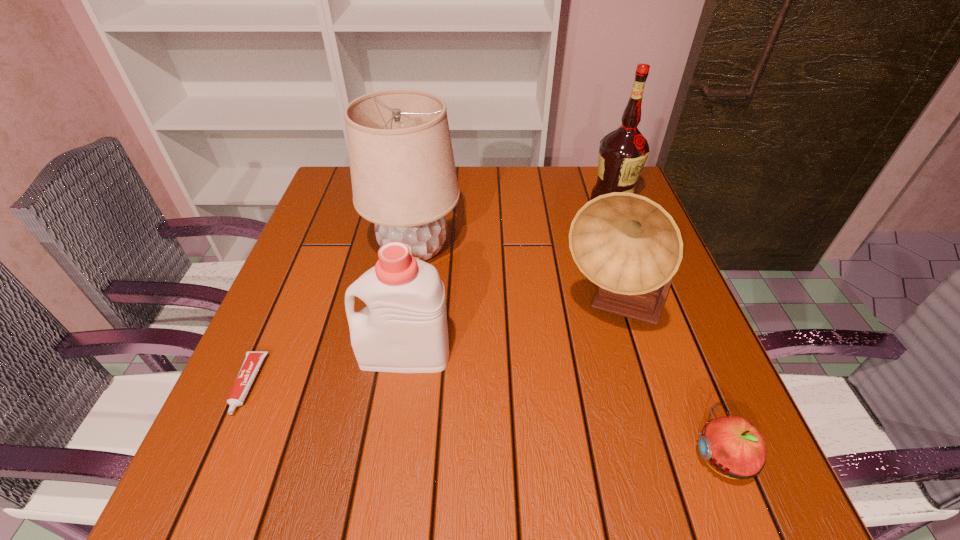
The width and height of the screenshot is (960, 540). Identify the location of free spot located on the horn of the phonograph record. (650, 427).

You are a GUI agent. You are given a task and a screenshot of the screen. Output one action in this format:
    pyautogui.click(x=<x>, y=<y>)
    Task: Click on the vacant space located 0.060m on the handle side of the third shortest object
    Image resolution: width=960 pixels, height=540 pixels.
    Given the screenshot: What is the action you would take?
    pyautogui.click(x=328, y=354)

The width and height of the screenshot is (960, 540). I want to click on vacant space positioned on the handle side of the third shortest object, so click(x=302, y=354).

What are the coordinates of `blank space located 0.210m on the handle side of the third shortest object` in the screenshot? It's located at (251, 354).

Where is `free point located on the left of the nearest object`? free point located on the left of the nearest object is located at coordinates coord(480,457).

This screenshot has height=540, width=960. In order to click on free space located 0.100m at the nozzle of the leftmost object in this screenshot , I will do `click(207, 476)`.

The image size is (960, 540). Identify the location of object situated at the far edge. (623, 152).

Find the location of a particular element. This screenshot has height=540, width=960. object that is at the near edge is located at coordinates (732, 445).

Locate an element on the screen. Image resolution: width=960 pixels, height=540 pixels. object situated at the left edge is located at coordinates (253, 359).

Where is `alcohol that is at the right edge`? This screenshot has height=540, width=960. alcohol that is at the right edge is located at coordinates (623, 152).